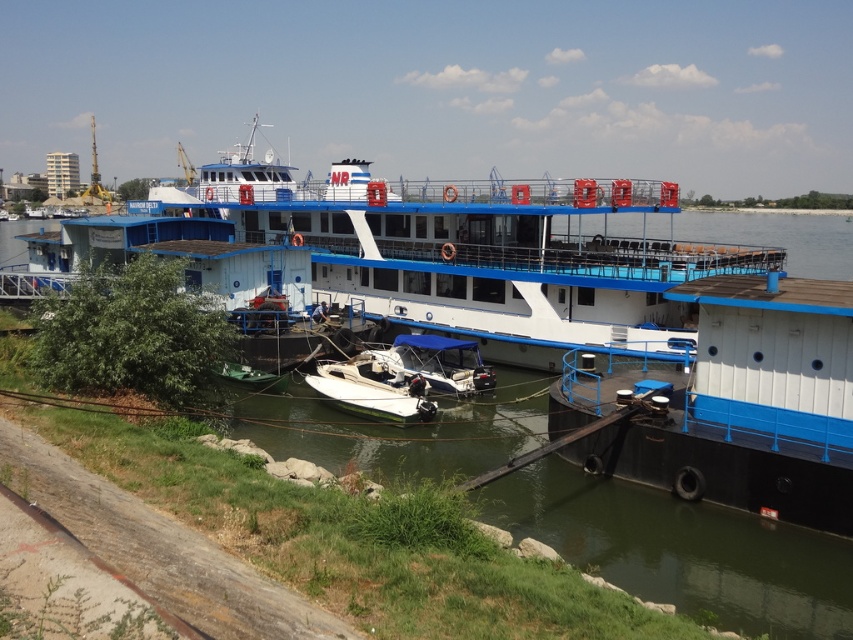
You are standing on the boat and looking at two points on the dock. The first point is at coordinates point (387,371) and the second is at point (442,374). Which point is closer to you?

Point (387,371) is further to the camera than point (442,374), so the point closer to you is point (442,374).

You are a maintenance worker on the boat and need to move a 1.2 meter long tool from the white glossy boat at center to the blue canvas boat at center. Can you move the tool without bending it?

The white glossy boat at center and blue canvas boat at center are 1.11 meters apart from each other. Since the tool is 1.2 meters long, it is longer than the distance between the boats. Therefore, you would need to bend the tool to move it between the two boats.